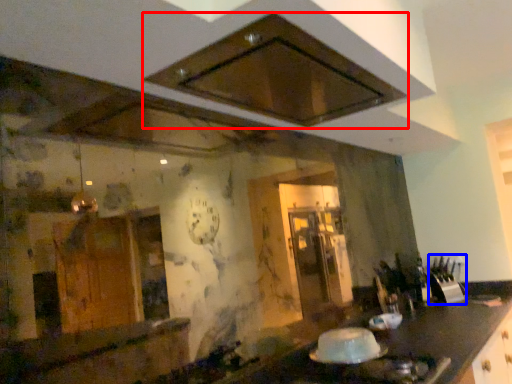
Question: Among these objects, which one is farthest to the camera, exhaust hood (highlighted by a red box) or appliance (highlighted by a blue box)?

Choices:
 (A) exhaust hood
 (B) appliance

Answer: (B)